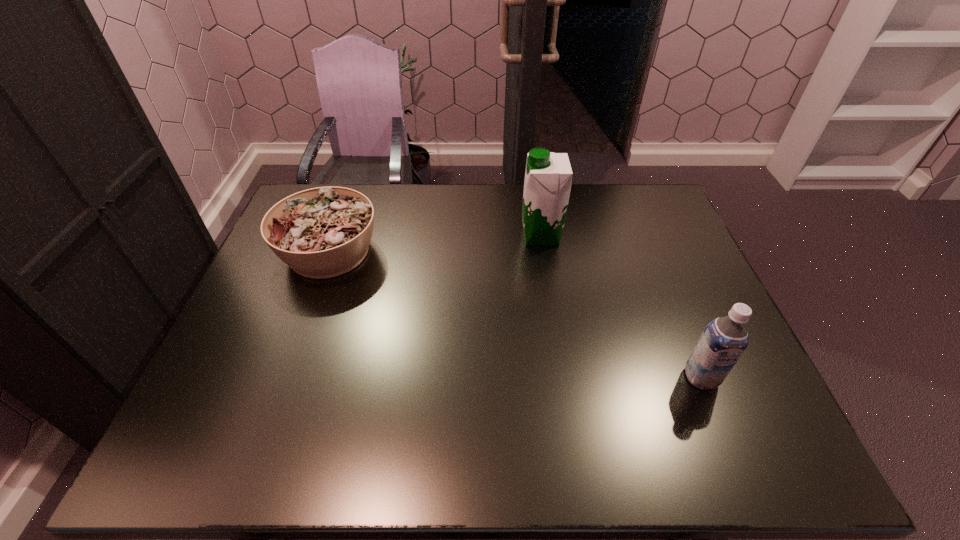
Locate an element on the screen. the left soya milk is located at coordinates (548, 176).

Where is `the second object from left to right`? the second object from left to right is located at coordinates click(x=548, y=176).

What are the coordinates of `the nearest object` in the screenshot? It's located at (724, 339).

Where is `the nearer soya milk`? the nearer soya milk is located at coordinates (724, 339).

The height and width of the screenshot is (540, 960). What are the coordinates of `salad` in the screenshot? It's located at (323, 232).

Identify the location of the shortest object. (323, 232).

Image resolution: width=960 pixels, height=540 pixels. I want to click on free region located 0.220m on the front-facing side of the taller soya milk, so click(x=451, y=236).

The width and height of the screenshot is (960, 540). What are the coordinates of `free space located 0.320m on the front-facing side of the taller soya milk` in the screenshot? It's located at (420, 236).

The width and height of the screenshot is (960, 540). I want to click on vacant region located 0.210m on the front-facing side of the taller soya milk, so click(x=454, y=236).

Locate an element on the screen. The image size is (960, 540). vacant region located on the label of the right soya milk is located at coordinates (722, 428).